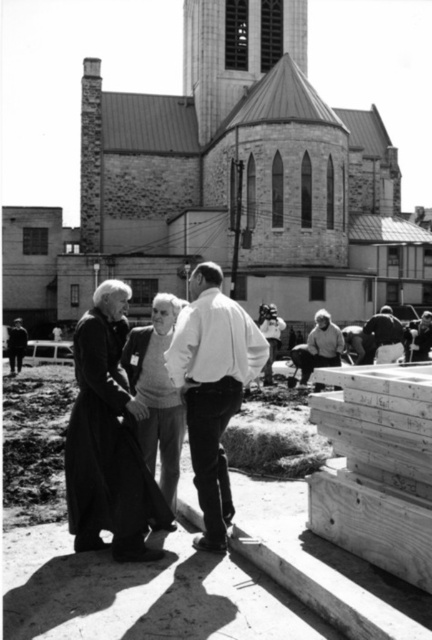
Consider the image. Based on the scene described, which object occupies more space in the image? Please choose between the stone church at center and the dark gray fabric jacket at lower right.

The stone church at center is larger in size than the dark gray fabric jacket at lower right, so it occupies more space in the image.

You are standing in front of the church and want to greet the person wearing the white matte shirt at center. Which direction should you walk to approach them first before reaching the dark gray fabric jacket at lower right?

You should walk towards the white matte shirt at center since it is closer to you than the dark gray fabric jacket at lower right.

You are standing at the entrance of the stone church at center and want to greet the person wearing the dark gray fabric jacket at lower right. Which direction should you walk to approach them?

The dark gray fabric jacket at lower right is behind the stone church at center, so you should walk towards the back of the stone church at center to reach them.